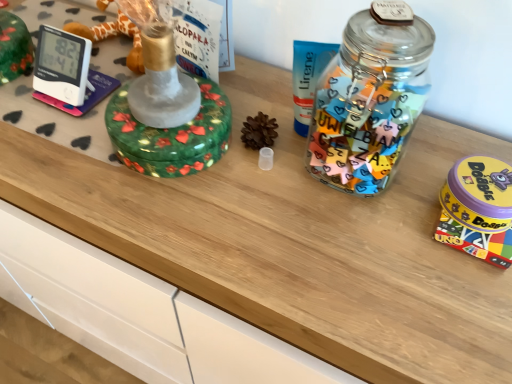
Image resolution: width=512 pixels, height=384 pixels. Identify the location of vacant area that lies in front of transparent plastic pinecone at center, marked as the 1th toy in a left-to-right arrangement. (271, 231).